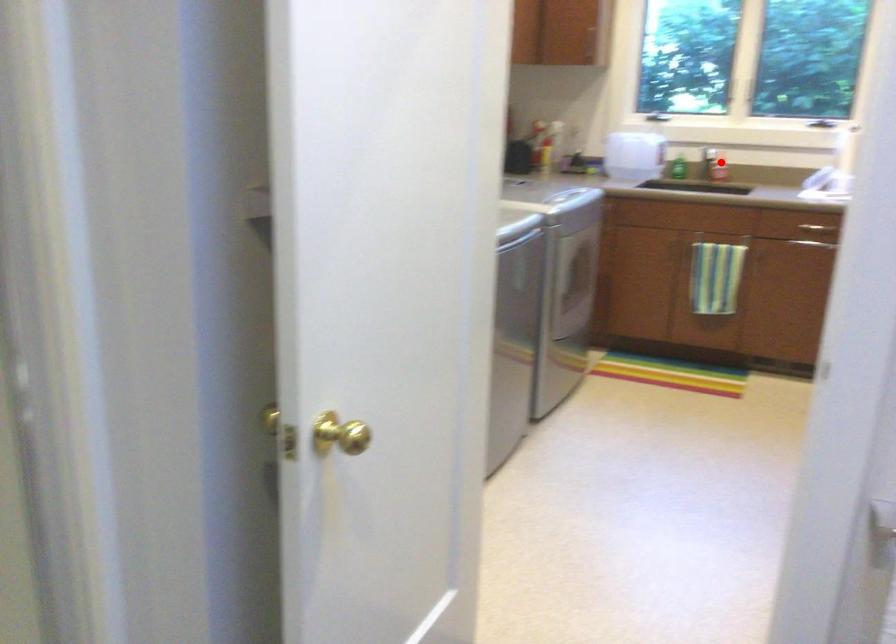
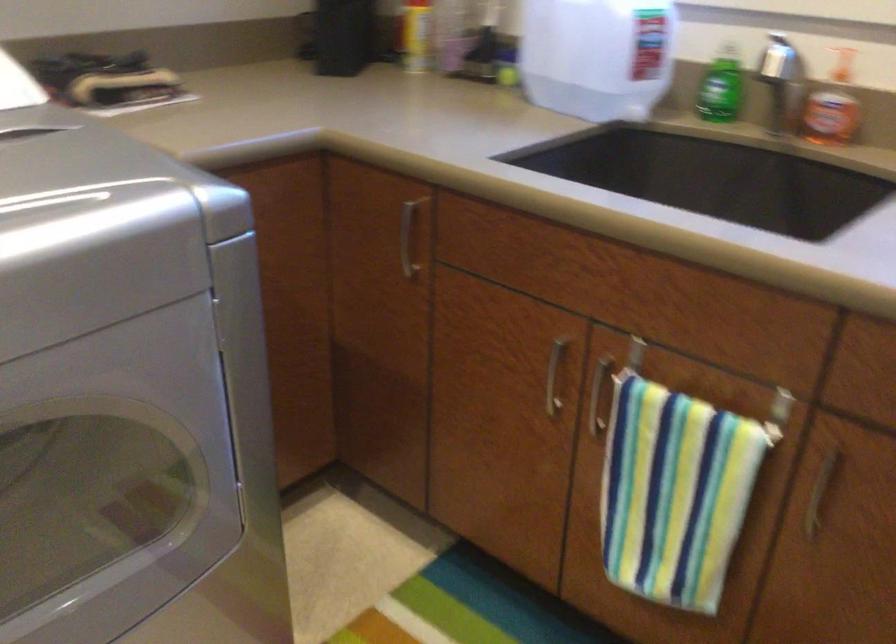
Question: I am providing you with two images of the same scene from different viewpoints. A red point is shown in image1. For the corresponding object point in image2, is it positioned nearer or farther from the camera?

Choices:
 (A) Nearer
 (B) Farther

Answer: (A)